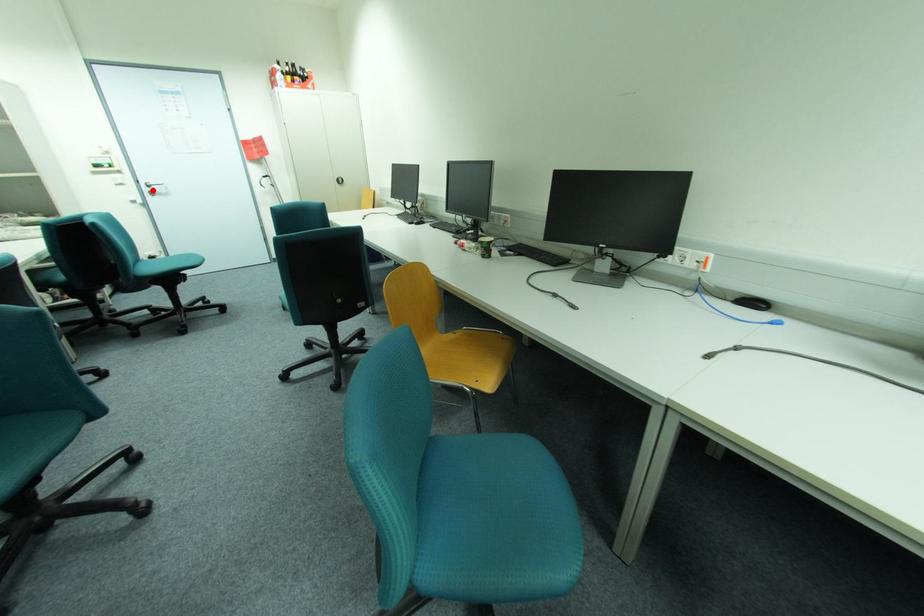
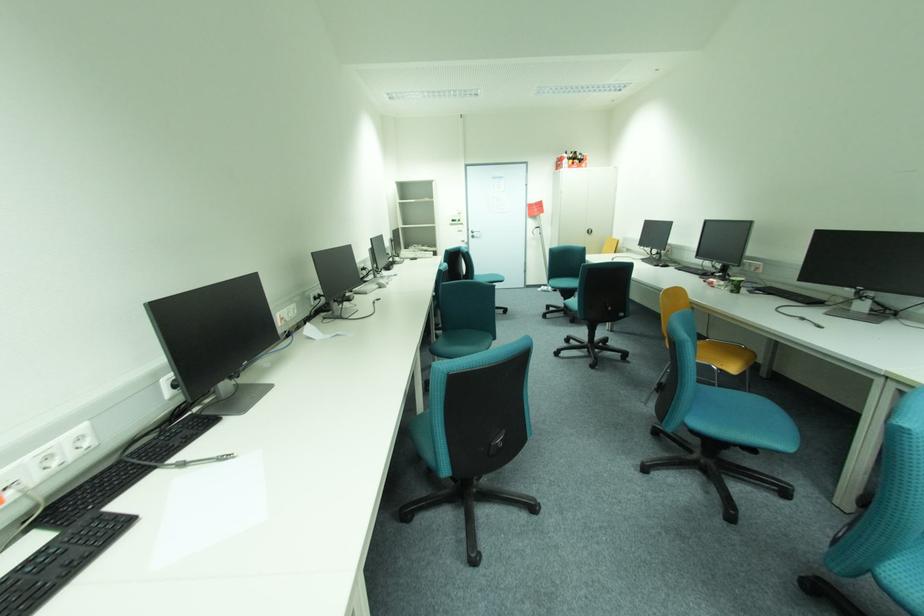
Find the pixel in the second image that matches the highlighted location in the first image.

(477, 235)